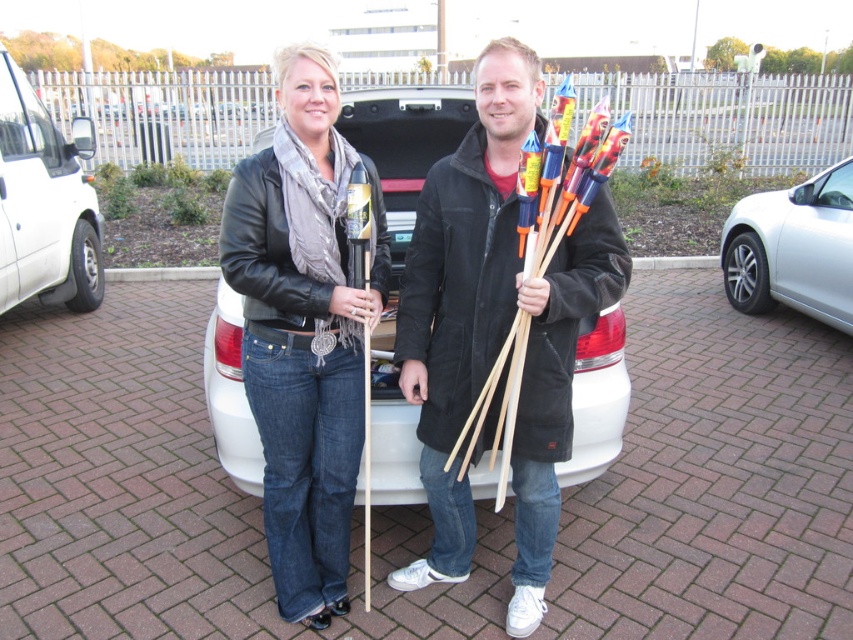
You are a photographer trying to capture both the black suede coat at center and the white matte car at center in a single frame. Given that your camera has a fixed focal length, which object should you focus on first to ensure both are in the frame?

The black suede coat at center is wider than the white matte car at center. To ensure both are in the frame, focus on the wider object first, which is the black suede coat at center, then adjust the camera to include the white matte car at center.

You are a delivery person who needs to load a large package into your vehicle. You see the black suede coat at center and the white matte van at left in the parking lot. Which object takes up more space and should be moved to make room for the package?

The white matte van at left takes up more space than the black suede coat at center, so you should move the black suede coat at center to make room for the package.